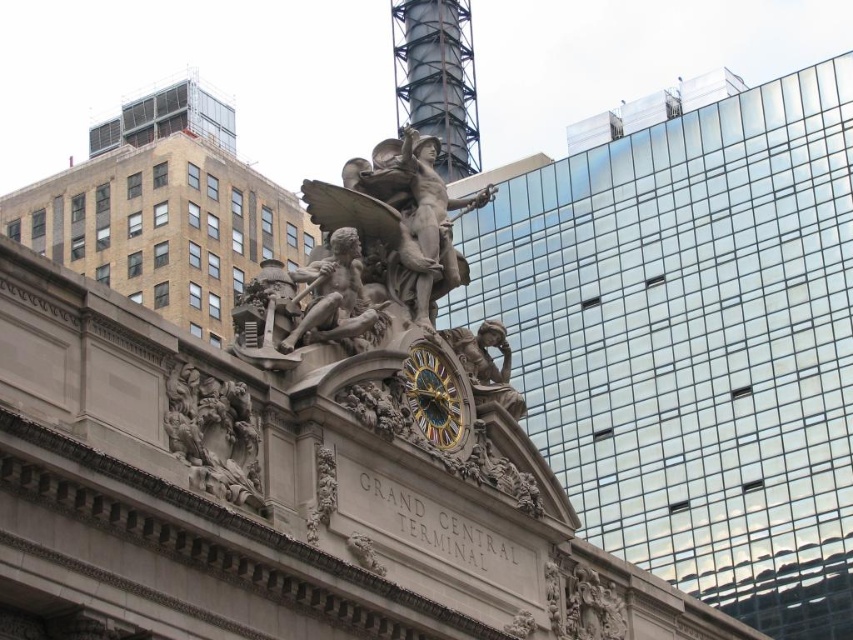
Question: Can you confirm if shiny metallic tower at upper center is bigger than matte bronze statue at center?

Choices:
 (A) yes
 (B) no

Answer: (A)

Question: Is polished bronze statue at center to the right of gold metallic clock at center from the viewer's perspective?

Choices:
 (A) yes
 (B) no

Answer: (B)

Question: Which point is closer to the camera?

Choices:
 (A) (x=450, y=442)
 (B) (x=224, y=477)
 (C) (x=334, y=332)
 (D) (x=495, y=394)

Answer: (B)

Question: Which point is farther to the camera?

Choices:
 (A) (416, 368)
 (B) (241, 484)
 (C) (358, 321)
 (D) (433, 132)

Answer: (D)

Question: Observing the image, what is the correct spatial positioning of carved stone relief at center in reference to gold metallic clock at center?

Choices:
 (A) left
 (B) right

Answer: (A)

Question: Which object appears farthest from the camera in this image?

Choices:
 (A) shiny metallic tower at upper center
 (B) gold metallic clock at center

Answer: (A)